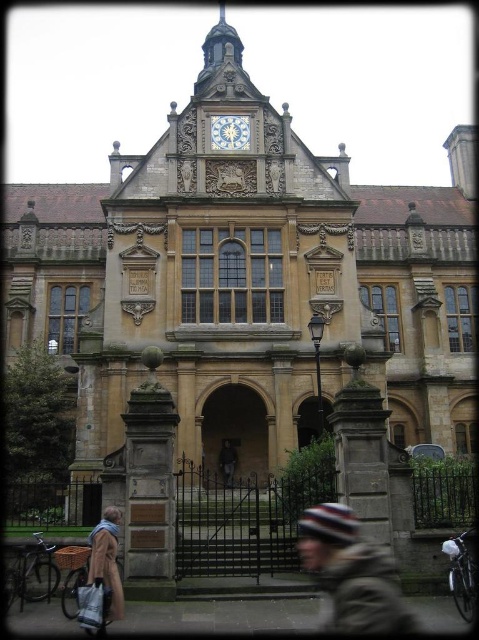
What is the position of the brown woolen hat at center relative to the white marble clock at upper center?

The brown woolen hat at center is positioned to the right of the white marble clock at upper center.

You are a student standing in front of the historic building and you see a brown woolen hat at center and a dark brown leather jacket at center. Which item is nearer to you?

The brown woolen hat at center is closer to the viewer than the dark brown leather jacket at center.